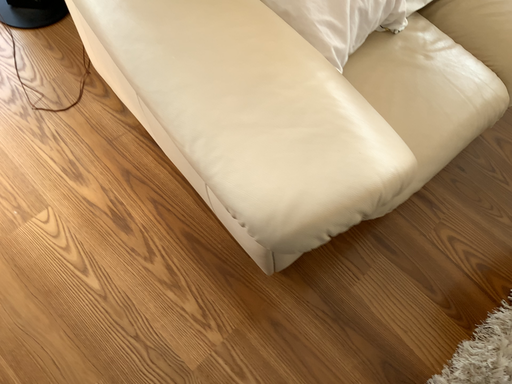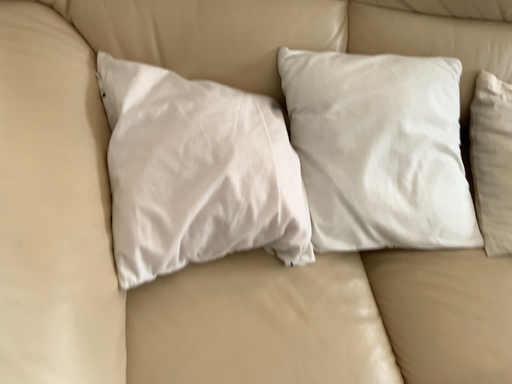
Question: Which way did the camera rotate in the video?

Choices:
 (A) rotated left
 (B) rotated right

Answer: (A)